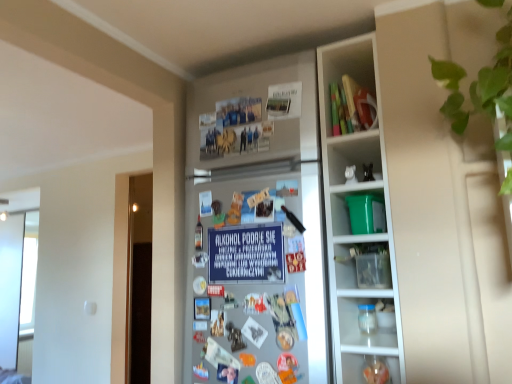
Question: Considering the relative positions of green plastic bucket at upper right, the first cabinet ordered from the bottom, and transparent plastic jar at lower right in the image provided, is green plastic bucket at upper right, the first cabinet ordered from the bottom, to the left of transparent plastic jar at lower right from the viewer's perspective?

Choices:
 (A) no
 (B) yes

Answer: (B)

Question: Does green plastic bucket at upper right, the first cabinet ordered from the bottom, turn towards transparent plastic jar at lower right?

Choices:
 (A) no
 (B) yes

Answer: (A)

Question: Does green plastic bucket at upper right, the first cabinet ordered from the bottom, come behind transparent plastic jar at lower right?

Choices:
 (A) no
 (B) yes

Answer: (A)

Question: Are green plastic bucket at upper right, the first cabinet ordered from the bottom, and transparent plastic jar at lower right far apart?

Choices:
 (A) yes
 (B) no

Answer: (B)

Question: Is green plastic bucket at upper right, which is counted as the 2th cabinet, starting from the top, to the right of transparent plastic jar at lower right from the viewer's perspective?

Choices:
 (A) yes
 (B) no

Answer: (B)

Question: Is green plastic bucket at upper right, the first cabinet ordered from the bottom, looking in the opposite direction of transparent plastic jar at lower right?

Choices:
 (A) yes
 (B) no

Answer: (B)

Question: Considering the relative positions of green leafy plant at upper right and matte plastic toys at upper right, the 1th cabinet positioned from the top, in the image provided, is green leafy plant at upper right behind matte plastic toys at upper right, the 1th cabinet positioned from the top,?

Choices:
 (A) yes
 (B) no

Answer: (B)

Question: Is green leafy plant at upper right bigger than matte plastic toys at upper right, the 1th cabinet positioned from the top?

Choices:
 (A) no
 (B) yes

Answer: (B)

Question: Considering the relative positions of green leafy plant at upper right and matte plastic toys at upper right, positioned as the 2th cabinet in bottom-to-top order, in the image provided, is green leafy plant at upper right to the left of matte plastic toys at upper right, positioned as the 2th cabinet in bottom-to-top order, from the viewer's perspective?

Choices:
 (A) yes
 (B) no

Answer: (B)

Question: Is green leafy plant at upper right beside matte plastic toys at upper right, positioned as the 2th cabinet in bottom-to-top order?

Choices:
 (A) no
 (B) yes

Answer: (A)

Question: From a real-world perspective, is green leafy plant at upper right over matte plastic toys at upper right, positioned as the 2th cabinet in bottom-to-top order?

Choices:
 (A) yes
 (B) no

Answer: (B)

Question: Is matte plastic toys at upper right, positioned as the 2th cabinet in bottom-to-top order, located within green leafy plant at upper right?

Choices:
 (A) no
 (B) yes

Answer: (A)

Question: Is green plastic bucket at upper right, the first cabinet ordered from the bottom, looking in the opposite direction of matte plastic toys at upper right, the 1th cabinet positioned from the top?

Choices:
 (A) no
 (B) yes

Answer: (A)